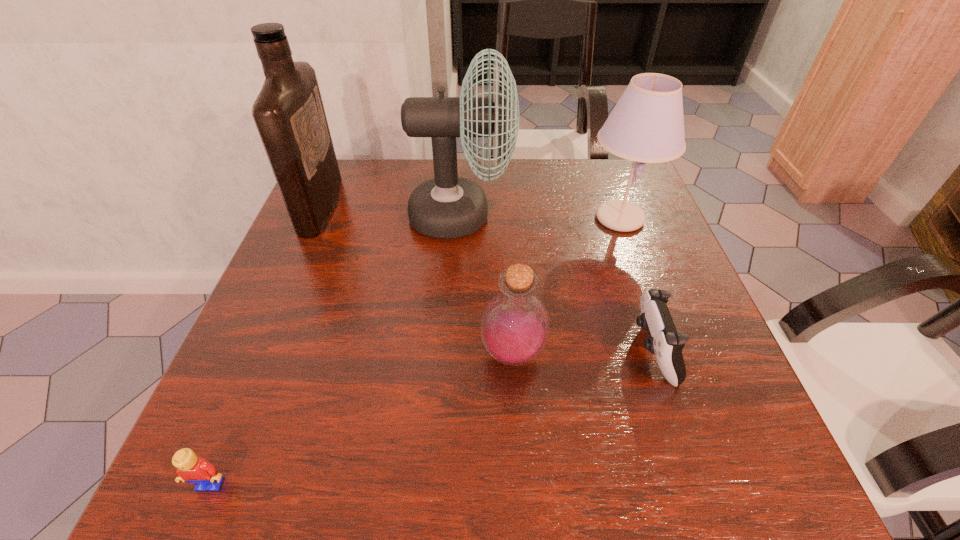
Where is `vacant point located on the front-facing side of the control`? vacant point located on the front-facing side of the control is located at coordinates (512, 350).

The height and width of the screenshot is (540, 960). What are the coordinates of `free spot located 0.370m on the front-facing side of the control` in the screenshot? It's located at (427, 350).

The height and width of the screenshot is (540, 960). In order to click on blank area located on the front-facing side of the control in this screenshot , I will do `click(584, 350)`.

The image size is (960, 540). Find the location of `liquor located in the far edge section of the desktop`. liquor located in the far edge section of the desktop is located at coordinates pos(289,114).

This screenshot has height=540, width=960. Find the location of `fan located in the far edge section of the desktop`. fan located in the far edge section of the desktop is located at coordinates click(x=447, y=206).

Where is `lampshade located in the far edge section of the desktop`? lampshade located in the far edge section of the desktop is located at coordinates (647, 124).

You are a GUI agent. You are given a task and a screenshot of the screen. Output one action in this format:
    pyautogui.click(x=<x>, y=<y>)
    Task: Click on the object that is at the near edge
    
    Given the screenshot: What is the action you would take?
    pyautogui.click(x=189, y=468)

Locate an element on the screen. The width and height of the screenshot is (960, 540). liquor at the left edge is located at coordinates (289, 114).

Where is `Lego present at the left edge`? The height and width of the screenshot is (540, 960). Lego present at the left edge is located at coordinates (189, 468).

I want to click on lampshade at the right edge, so click(647, 124).